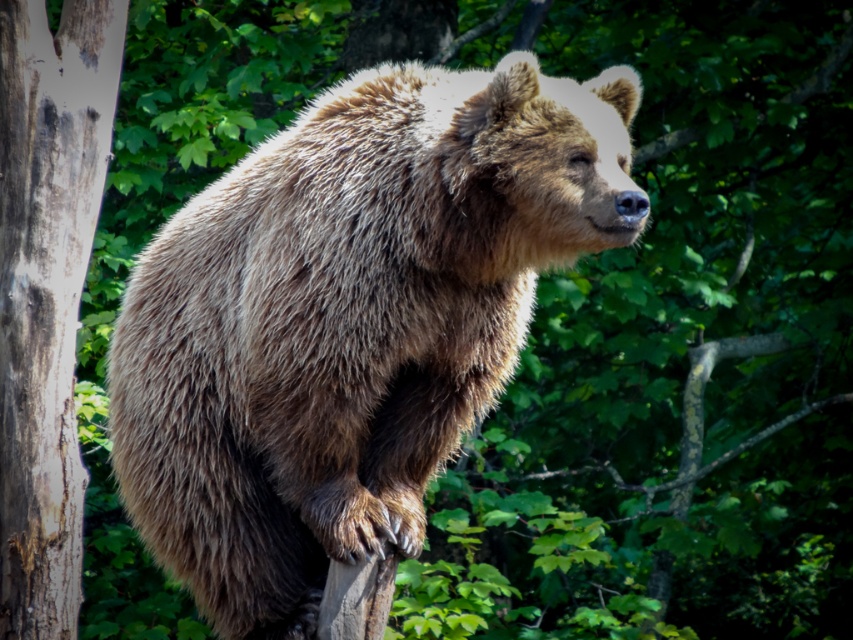
Question: Which object appears closest to the camera in this image?

Choices:
 (A) smooth gray bark at left
 (B) fuzzy brown bear at center

Answer: (B)

Question: Can you confirm if fuzzy brown bear at center is positioned below smooth gray bark at left?

Choices:
 (A) no
 (B) yes

Answer: (A)

Question: Considering the relative positions of fuzzy brown bear at center and smooth gray bark at left in the image provided, where is fuzzy brown bear at center located with respect to smooth gray bark at left?

Choices:
 (A) left
 (B) right

Answer: (B)

Question: Does fuzzy brown bear at center lie in front of smooth gray bark at left?

Choices:
 (A) yes
 (B) no

Answer: (A)

Question: Which point appears farthest from the camera in this image?

Choices:
 (A) (209, 209)
 (B) (28, 301)

Answer: (A)